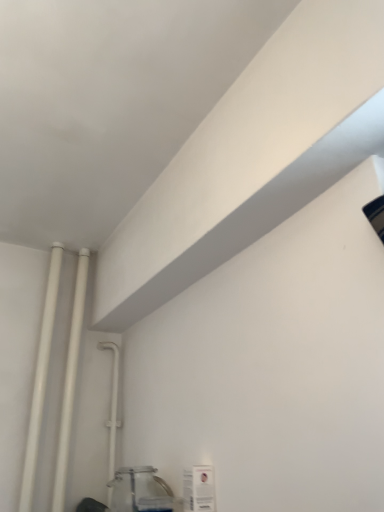
Question: Is clear glass jar at lower left to the left or to the right of white glossy pipes at left, the 2th pipe when ordered from right to left, in the image?

Choices:
 (A) left
 (B) right

Answer: (B)

Question: Based on their sizes in the image, would you say clear glass jar at lower left is bigger or smaller than white glossy pipes at left, the 2th pipe when ordered from right to left?

Choices:
 (A) small
 (B) big

Answer: (B)

Question: Estimate the real-world distances between objects in this image. Which object is closer to the white glossy pipes at left, the 2th pipe when ordered from right to left?

Choices:
 (A) white plastic pipe at upper left, placed as the 3th pipe when sorted from left to right
 (B) clear glass jar at lower left
 (C) white matte pipe at left, the 3th pipe from the right

Answer: (C)

Question: Which of these objects is positioned closest to the white matte pipe at left, the 3th pipe from the right?

Choices:
 (A) clear glass jar at lower left
 (B) white plastic pipe at upper left, marked as the first pipe in a right-to-left arrangement
 (C) white glossy pipes at left, positioned as the second pipe in left-to-right order

Answer: (C)